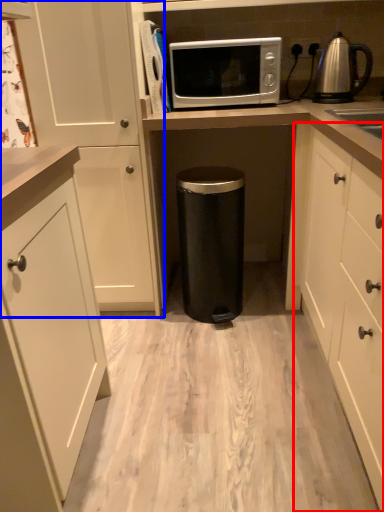
Question: Which object appears closest to the camera in this image, cabinetry (highlighted by a red box) or cabinetry (highlighted by a blue box)?

Choices:
 (A) cabinetry
 (B) cabinetry

Answer: (A)